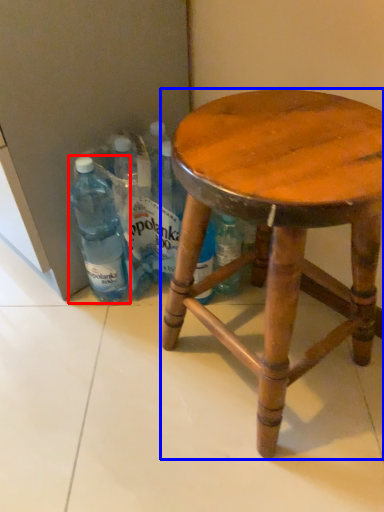
Question: Which object is closer to the camera taking this photo, bottle (highlighted by a red box) or stool (highlighted by a blue box)?

Choices:
 (A) bottle
 (B) stool

Answer: (B)